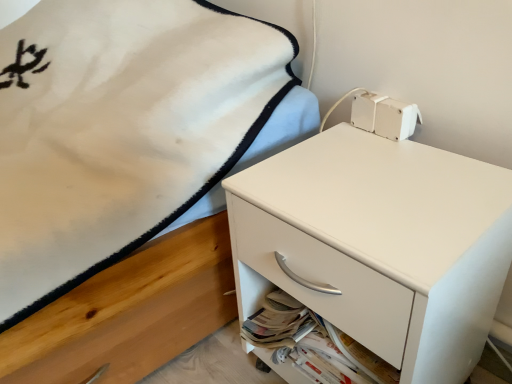
Where is `white matte chest of drawers at center`? The image size is (512, 384). white matte chest of drawers at center is located at coordinates (379, 244).

The width and height of the screenshot is (512, 384). What do you see at coordinates (379, 244) in the screenshot?
I see `white matte chest of drawers at center` at bounding box center [379, 244].

Describe the element at coordinates (318, 280) in the screenshot. I see `white matte drawer at lower right` at that location.

At what (x,y) coordinates should I click in order to perform the action: click on white matte drawer at lower right. Please return your answer as a coordinate pair (x, y). The height and width of the screenshot is (384, 512). Looking at the image, I should click on (318, 280).

In order to click on white matte chest of drawers at center in this screenshot , I will do `click(379, 244)`.

Which object is positioned more to the right, white matte drawer at lower right or white matte chest of drawers at center?

From the viewer's perspective, white matte chest of drawers at center appears more on the right side.

Which object is closer to the camera, white matte drawer at lower right or white matte chest of drawers at center?

Positioned in front is white matte chest of drawers at center.

Which is farther from the camera, (327, 262) or (506, 197)?

The point (506, 197) is farther.

From the image's perspective, which one is positioned higher, white matte drawer at lower right or white matte chest of drawers at center?

From the image's view, white matte chest of drawers at center is above.

From a real-world perspective, between white matte drawer at lower right and white matte chest of drawers at center, who is vertically higher?

white matte chest of drawers at center, from a real-world perspective.

Which of these two, white matte drawer at lower right or white matte chest of drawers at center, is thinner?

With smaller width is white matte drawer at lower right.

Does white matte drawer at lower right have a greater height compared to white matte chest of drawers at center?

In fact, white matte drawer at lower right may be shorter than white matte chest of drawers at center.

Can you confirm if white matte drawer at lower right is bigger than white matte chest of drawers at center?

No, white matte drawer at lower right is not bigger than white matte chest of drawers at center.

Is white matte drawer at lower right outside of white matte chest of drawers at center?

No, white matte drawer at lower right is inside or overlapping with white matte chest of drawers at center.

Looking at this image, is white matte drawer at lower right not near white matte chest of drawers at center?

white matte drawer at lower right is actually quite close to white matte chest of drawers at center.

Consider the image. Is white matte drawer at lower right aimed at white matte chest of drawers at center?

Yes, white matte drawer at lower right is turned towards white matte chest of drawers at center.

Consider the image. Can you tell me how much white matte drawer at lower right and white matte chest of drawers at center differ in facing direction?

The facing directions of white matte drawer at lower right and white matte chest of drawers at center are 0.346 degrees apart.

This screenshot has height=384, width=512. Identify the location of the chest of drawers that appears above the white matte drawer at lower right (from a real-world perspective). pos(379,244).

Considering the relative positions of white matte chest of drawers at center and white matte drawer at lower right in the image provided, is white matte chest of drawers at center to the left or to the right of white matte drawer at lower right?

From the image, it's evident that white matte chest of drawers at center is to the right of white matte drawer at lower right.

Which object is further away from the camera taking this photo, white matte chest of drawers at center or white matte drawer at lower right?

white matte drawer at lower right is behind.

Is point (404, 161) more distant than point (263, 236)?

Yes, it is.

From the image's perspective, which one is positioned lower, white matte chest of drawers at center or white matte drawer at lower right?

white matte drawer at lower right.

From a real-world perspective, is white matte chest of drawers at center physically above white matte drawer at lower right?

Yes, from a real-world perspective, white matte chest of drawers at center is above white matte drawer at lower right.

Between white matte chest of drawers at center and white matte drawer at lower right, which one has larger width?

white matte chest of drawers at center is wider.

Considering the sizes of white matte chest of drawers at center and white matte drawer at lower right in the image, is white matte chest of drawers at center taller or shorter than white matte drawer at lower right?

In the image, white matte chest of drawers at center appears to be taller than white matte drawer at lower right.

Between white matte chest of drawers at center and white matte drawer at lower right, which one has smaller size?

white matte drawer at lower right is smaller.

Based on the photo, would you say white matte drawer at lower right is part of white matte chest of drawers at center's contents?

Yes, white matte drawer at lower right can be found within white matte chest of drawers at center.

Is white matte chest of drawers at center not close to white matte drawer at lower right?

No, white matte chest of drawers at center is not far from white matte drawer at lower right.

Is white matte chest of drawers at center facing away from white matte drawer at lower right?

Result: Yes, white matte chest of drawers at center is facing away from white matte drawer at lower right.

Based on the photo, how different are the orientations of white matte chest of drawers at center and white matte drawer at lower right in degrees?

The facing directions of white matte chest of drawers at center and white matte drawer at lower right are 0.346 degrees apart.

At what (x,y) coordinates should I click in order to perform the action: click on chest of drawers above the white matte drawer at lower right (from a real-world perspective). Please return your answer as a coordinate pair (x, y). Looking at the image, I should click on (379, 244).

You are a GUI agent. You are given a task and a screenshot of the screen. Output one action in this format:
    pyautogui.click(x=<x>, y=<y>)
    Task: Click on the chest of drawers on the right side of white matte drawer at lower right
    
    Given the screenshot: What is the action you would take?
    pyautogui.click(x=379, y=244)

The image size is (512, 384). There is a white matte drawer at lower right. Find the location of `the chest of drawers above it (from a real-world perspective)`. the chest of drawers above it (from a real-world perspective) is located at coordinates (379, 244).